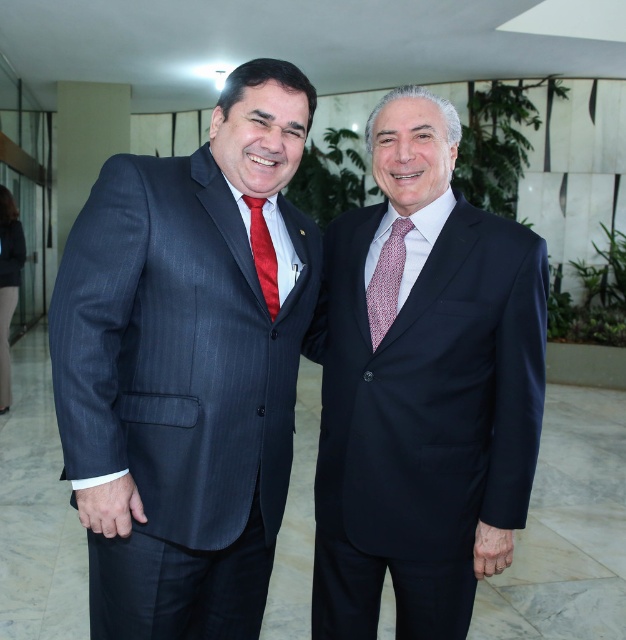
You are an interior designer working on a project. You need to place a decorative item exactly at the coordinates where the red textured tie at center is located. What object must you avoid placing the decorative item over?

You must avoid placing the decorative item over the red textured tie at center because it is already located at point (386, 280).

Consider the image. You are standing in the professional setting shown in the image. You need to move from your current position to the point labeled point (103, 440) and then to point (324, 369). Which point should you visit first to follow the shortest path?

You should visit point (103, 440) first because it is in front of point (324, 369), so reaching it first requires less movement.